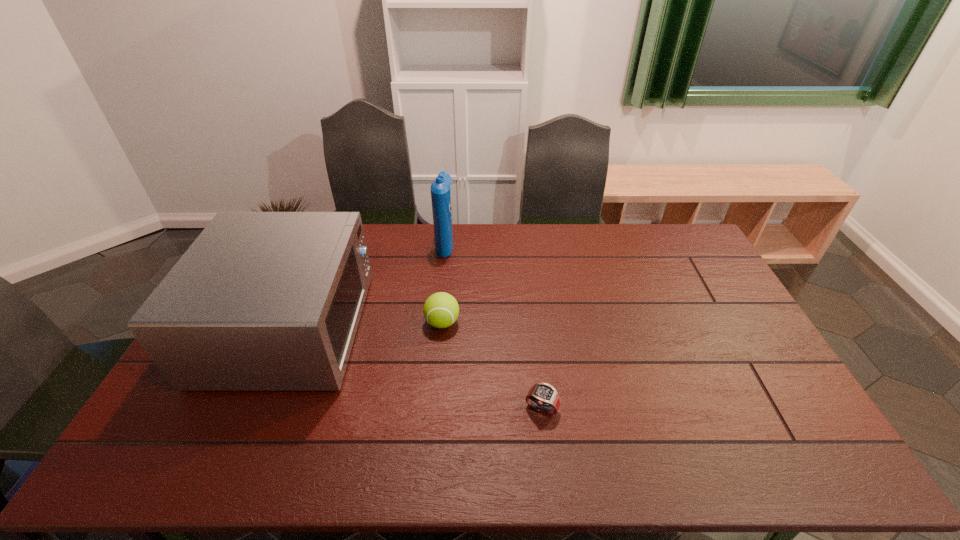
The image size is (960, 540). In order to click on object present at the left edge in this screenshot , I will do `click(261, 301)`.

In the image, there is a desktop. At what (x,y) coordinates should I click in order to perform the action: click on vacant region at the far edge. Please return your answer as a coordinate pair (x, y). Looking at the image, I should click on (539, 249).

This screenshot has width=960, height=540. I want to click on vacant region at the right edge of the desktop, so click(x=730, y=300).

Where is `free space at the near left corner of the desktop`? The width and height of the screenshot is (960, 540). free space at the near left corner of the desktop is located at coordinates (141, 469).

Image resolution: width=960 pixels, height=540 pixels. I want to click on vacant space at the far right corner of the desktop, so click(676, 233).

This screenshot has height=540, width=960. I want to click on free area in between the nearest object and the shampoo, so click(x=493, y=326).

The width and height of the screenshot is (960, 540). I want to click on vacant space that is in between the tennis ball and the farthest object, so tap(444, 283).

The width and height of the screenshot is (960, 540). Find the location of `free space that is in between the rightmost object and the tennis ball`. free space that is in between the rightmost object and the tennis ball is located at coordinates (492, 366).

What are the coordinates of `free space between the tennis ball and the shortest object` in the screenshot? It's located at pos(492,366).

The height and width of the screenshot is (540, 960). Identify the location of free point between the nearest object and the shampoo. (493, 326).